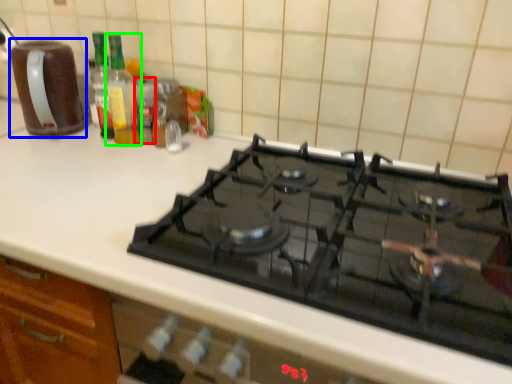
Question: Which object is positioned farthest from bottle (highlighted by a red box)? Select from kitchen appliance (highlighted by a blue box) and bottle (highlighted by a green box).

Choices:
 (A) kitchen appliance
 (B) bottle

Answer: (A)